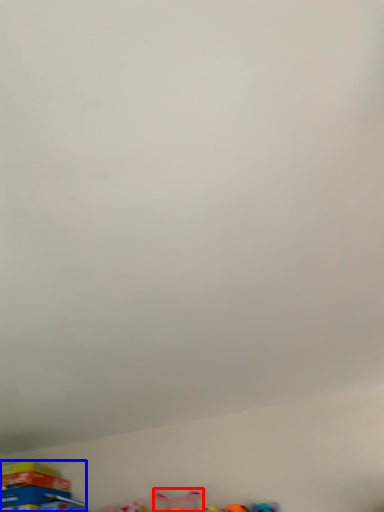
Question: Which of the following is the farthest to the observer, toy (highlighted by a red box) or toy (highlighted by a blue box)?

Choices:
 (A) toy
 (B) toy

Answer: (B)